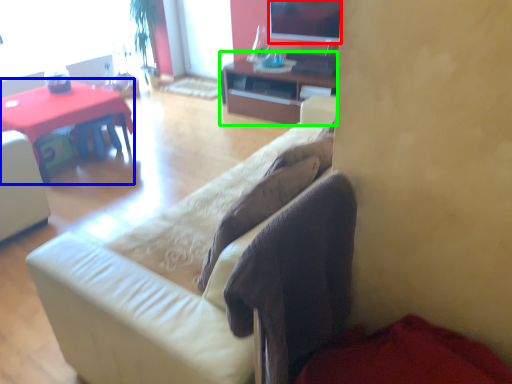
Question: Considering the real-world distances, which object is farthest from television (highlighted by a red box)? desk (highlighted by a blue box) or cabinetry (highlighted by a green box)?

Choices:
 (A) desk
 (B) cabinetry

Answer: (A)